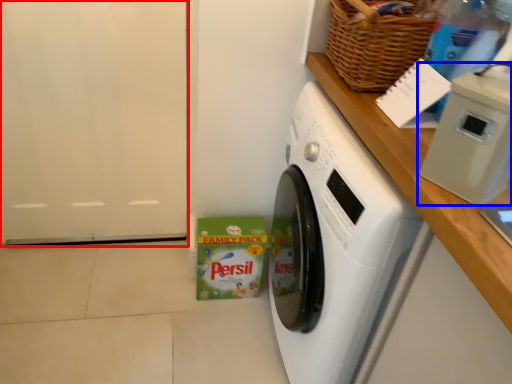
Question: Which point is further to the camera, door (highlighted by a red box) or appliance (highlighted by a blue box)?

Choices:
 (A) door
 (B) appliance

Answer: (A)